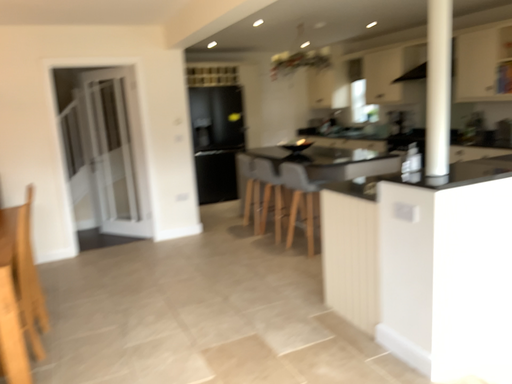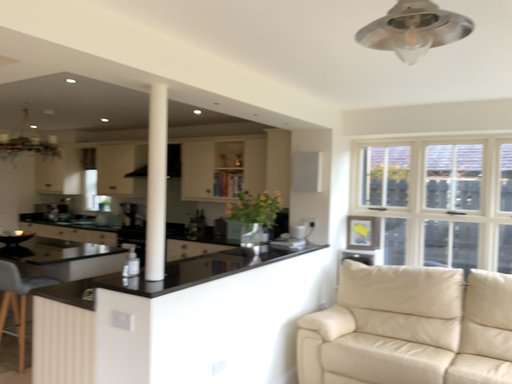
Question: How did the camera likely rotate when shooting the video?

Choices:
 (A) rotated upward
 (B) rotated downward

Answer: (A)